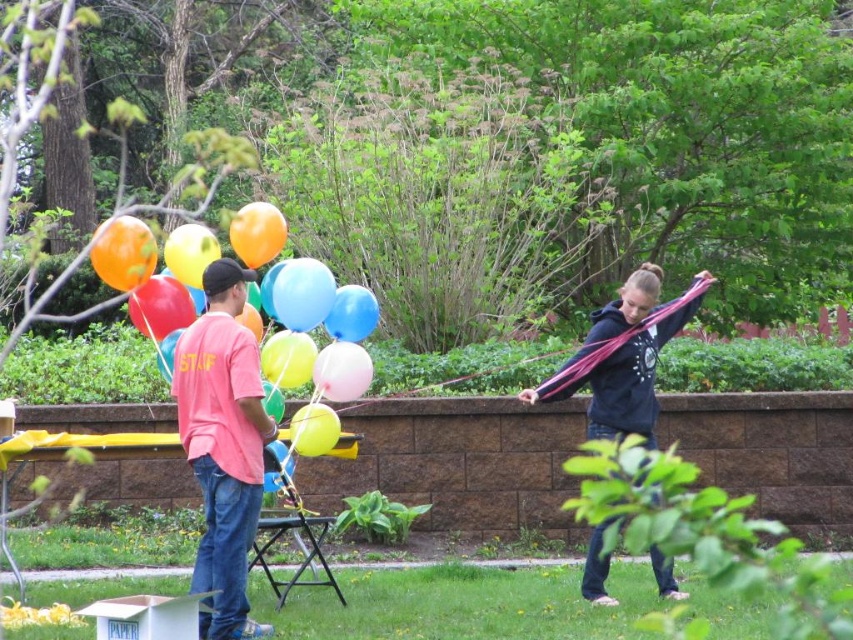
Question: Based on their relative distances, which object is farther from the matte pink shirt at center?

Choices:
 (A) dark blue hoodie at center
 (B) shiny multicolored balloons at left

Answer: (A)

Question: Which point appears farthest from the camera in this image?

Choices:
 (A) (604, 410)
 (B) (251, 237)
 (C) (227, 598)

Answer: (A)

Question: Does dark blue hoodie at center have a smaller size compared to shiny multicolored balloons at left?

Choices:
 (A) no
 (B) yes

Answer: (A)

Question: Which point appears closest to the camera in this image?

Choices:
 (A) [x=184, y=276]
 (B) [x=672, y=582]
 (C) [x=207, y=620]

Answer: (C)

Question: Can you confirm if matte pink shirt at center is bigger than shiny multicolored balloons at left?

Choices:
 (A) no
 (B) yes

Answer: (B)

Question: Can you confirm if matte pink shirt at center is positioned below shiny multicolored balloons at left?

Choices:
 (A) no
 (B) yes

Answer: (B)